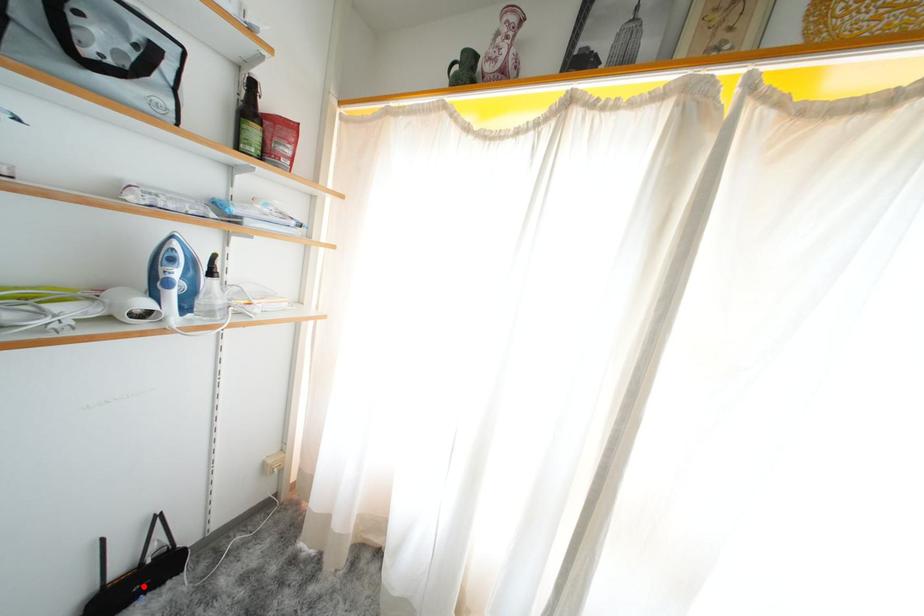
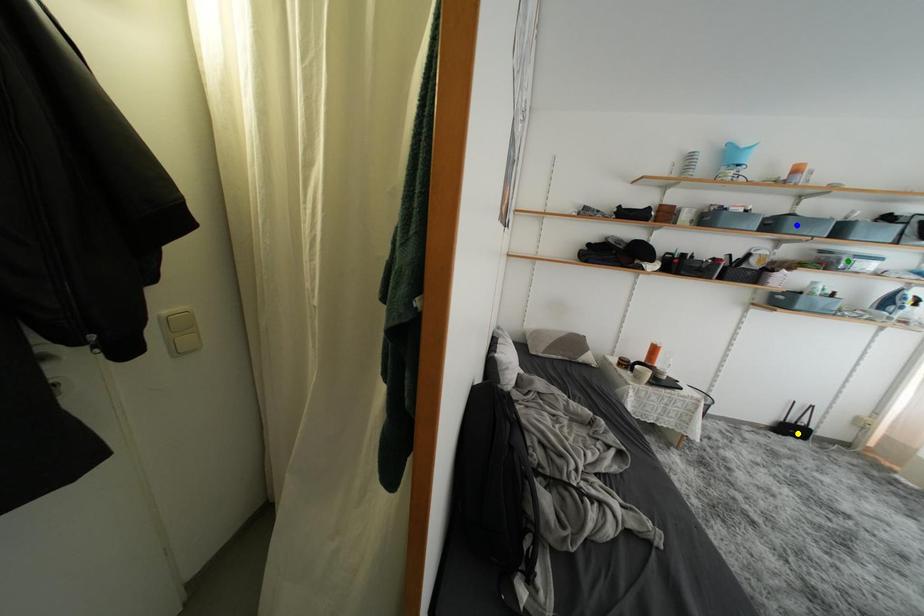
Question: I am providing you with two images of the same scene from different viewpoints. A red point is marked on the first image. You are given multiple points on the second image. Can you choose the point in image 2 that corresponds to the point in image 1?

Choices:
 (A) green point
 (B) blue point
 (C) yellow point

Answer: (C)